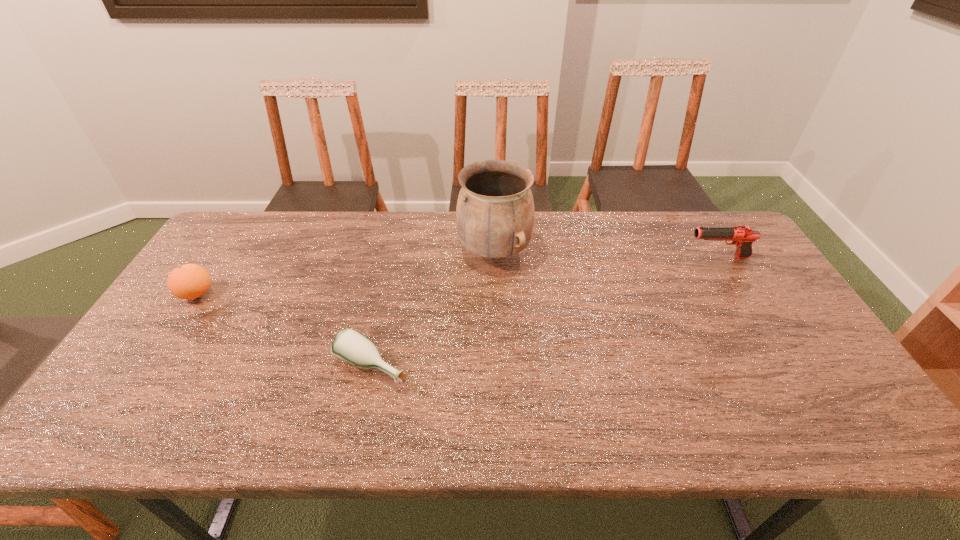
You are a GUI agent. You are given a task and a screenshot of the screen. Output one action in this format:
    pyautogui.click(x=<x>, y=<y>)
    Task: Click on the vacant region located 0.290m at the aiming end of the rightmost object
    
    Given the screenshot: What is the action you would take?
    pyautogui.click(x=595, y=258)

Where is `free spot located 0.110m at the aiming end of the rightmost object`? This screenshot has width=960, height=540. free spot located 0.110m at the aiming end of the rightmost object is located at coordinates (652, 258).

At what (x,y) coordinates should I click in order to perform the action: click on vacant space situated on the right of the third farthest object. Please return your answer as a coordinate pair (x, y). This screenshot has width=960, height=540. Looking at the image, I should click on (280, 294).

Identify the location of vacant space situated on the back of the nearest object. The height and width of the screenshot is (540, 960). (387, 298).

In order to click on urn present at the far edge in this screenshot , I will do `click(495, 212)`.

This screenshot has height=540, width=960. What are the coordinates of `gun that is at the far edge` in the screenshot? It's located at tap(742, 236).

The height and width of the screenshot is (540, 960). Find the location of `object at the left edge`. object at the left edge is located at coordinates (190, 281).

Where is `object located at the right edge`? object located at the right edge is located at coordinates (742, 236).

The image size is (960, 540). In order to click on object present at the far right corner in this screenshot , I will do `click(742, 236)`.

Find the location of a particular element. The height and width of the screenshot is (540, 960). vacant space at the far edge of the desktop is located at coordinates (403, 218).